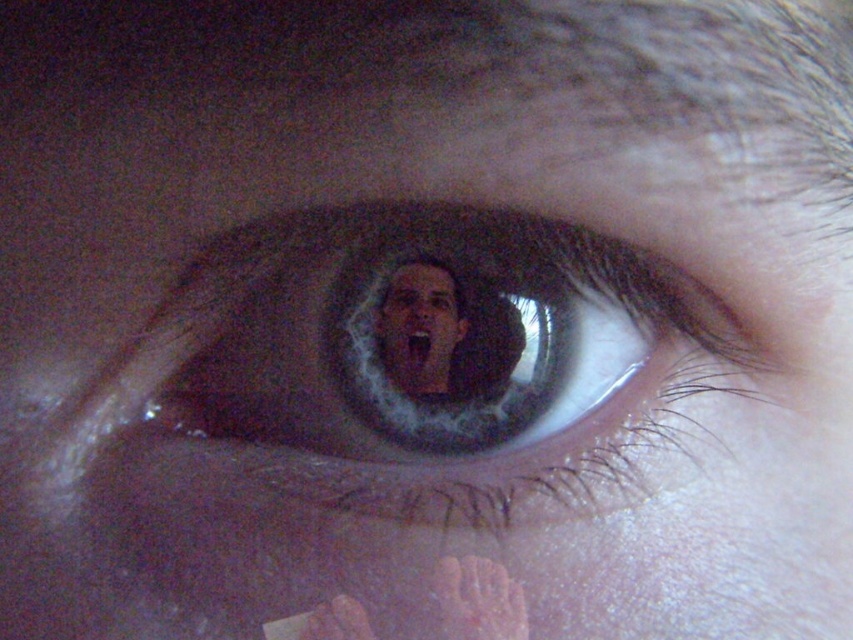
Question: Among these points, which one is farthest from the camera?

Choices:
 (A) (412, 310)
 (B) (401, 420)

Answer: (A)

Question: Does brown matte eye at center have a smaller size compared to smooth skin face at center?

Choices:
 (A) no
 (B) yes

Answer: (A)

Question: Which point is closer to the camera?

Choices:
 (A) brown matte eye at center
 (B) smooth skin face at center

Answer: (A)

Question: Does brown matte eye at center appear over smooth skin face at center?

Choices:
 (A) no
 (B) yes

Answer: (A)

Question: Which point is farther from the camera taking this photo?

Choices:
 (A) (445, 493)
 (B) (384, 292)

Answer: (B)

Question: Is brown matte eye at center above smooth skin face at center?

Choices:
 (A) yes
 (B) no

Answer: (B)